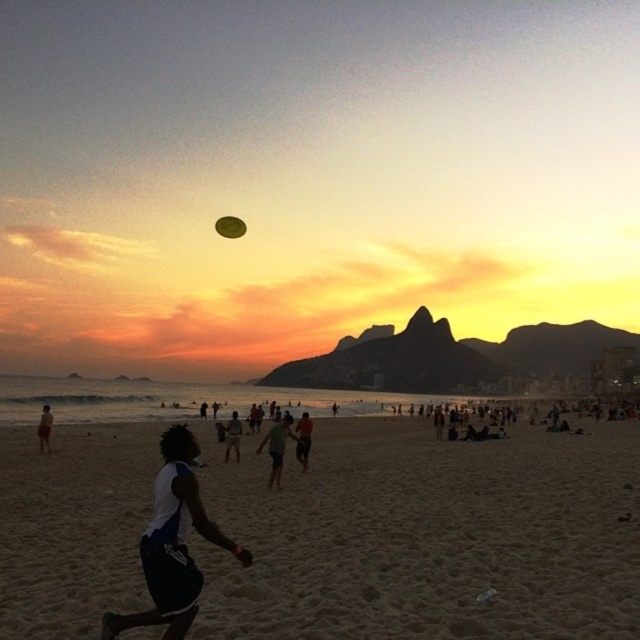
Question: Which is nearer to the light green fabric shirt at center?

Choices:
 (A) sandy beach at center
 (B) green matte frisbee at center
 (C) dark blue shorts at center
 (D) white matte shorts at lower left

Answer: (C)

Question: Estimate the real-world distances between objects in this image. Which object is closer to the white matte shorts at lower left?

Choices:
 (A) sandy beach at center
 (B) dark green shorts at center
 (C) green matte frisbee at center

Answer: (A)

Question: Is sandy beach at center positioned in front of white matte shorts at lower left?

Choices:
 (A) no
 (B) yes

Answer: (A)

Question: Which object is the farthest from the white matte shorts at lower left?

Choices:
 (A) light green fabric shirt at center
 (B) sandy beach at center
 (C) dark blue shorts at center
 (D) dark green shorts at center

Answer: (C)

Question: Is light green fabric shirt at center behind green matte frisbee at center?

Choices:
 (A) yes
 (B) no

Answer: (B)

Question: Is white matte shorts at lower left closer to the viewer compared to green matte frisbee at center?

Choices:
 (A) yes
 (B) no

Answer: (A)